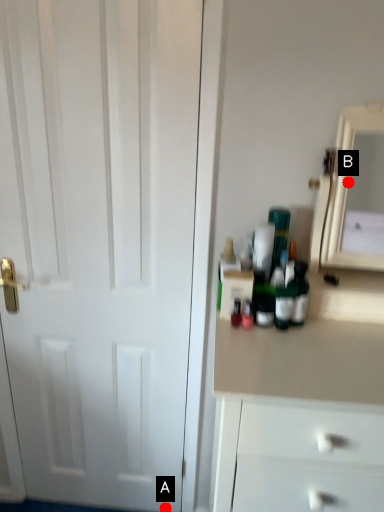
Question: Two points are circled on the image, labeled by A and B beside each circle. Which point is closer to the camera taking this photo?

Choices:
 (A) A is closer
 (B) B is closer

Answer: (A)